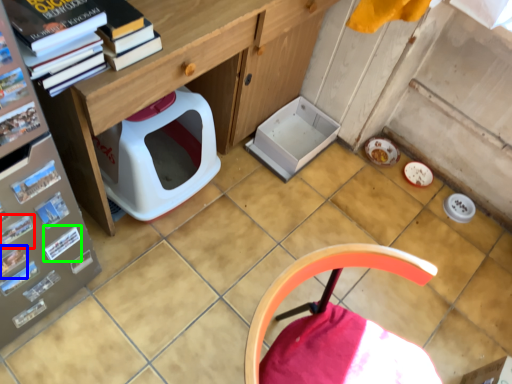
Question: Estimate the real-world distances between objects in this image. Which object is closer to magazine (highlighted by a red box), magazine (highlighted by a blue box) or paperback book (highlighted by a green box)?

Choices:
 (A) magazine
 (B) paperback book

Answer: (A)